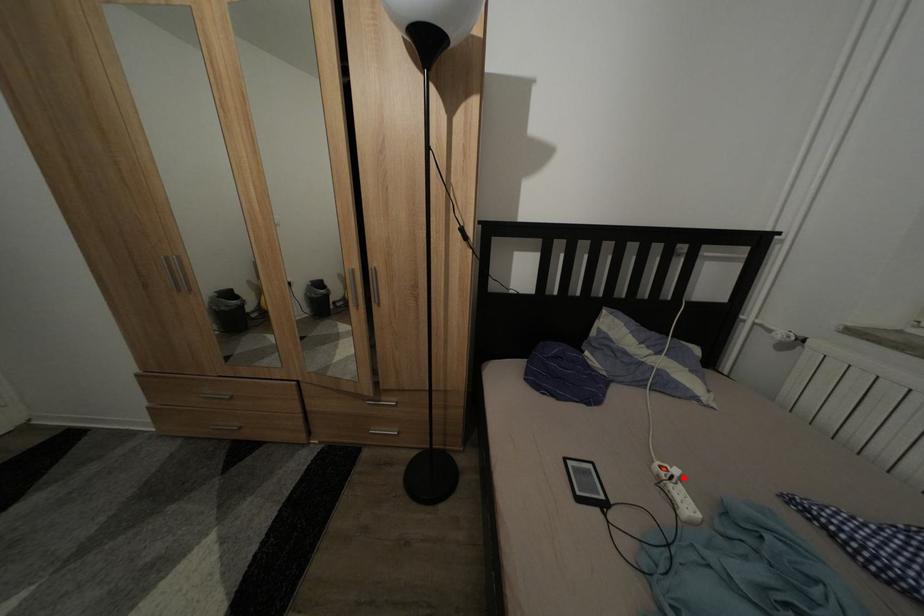
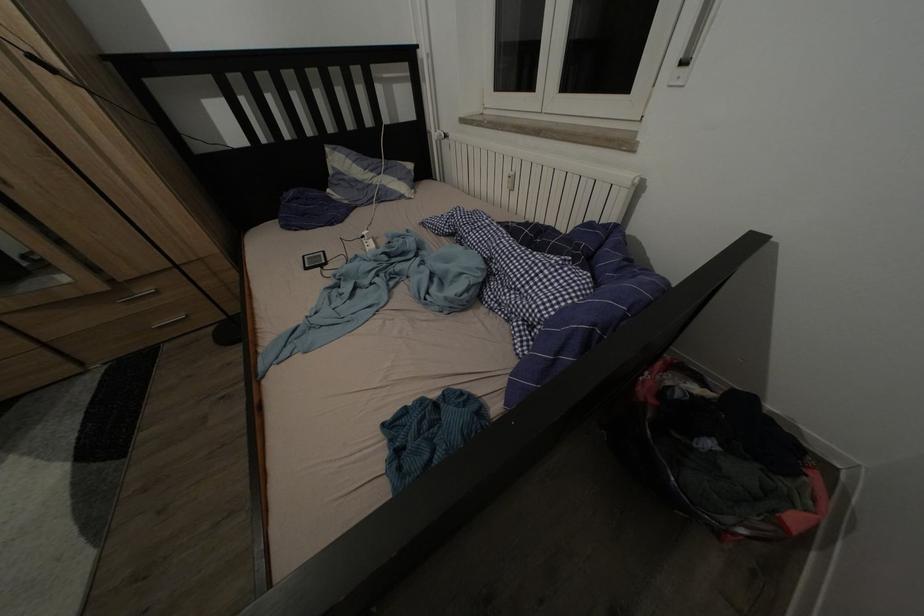
In the second image, find the point that corresponds to the highlighted location in the first image.

(372, 238)